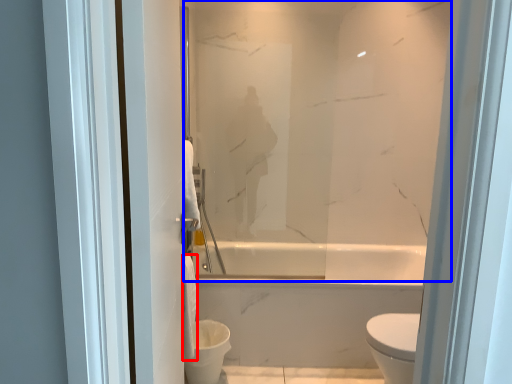
Question: Among these objects, which one is farthest to the camera, toilet paper (highlighted by a red box) or mirror (highlighted by a blue box)?

Choices:
 (A) toilet paper
 (B) mirror

Answer: (B)